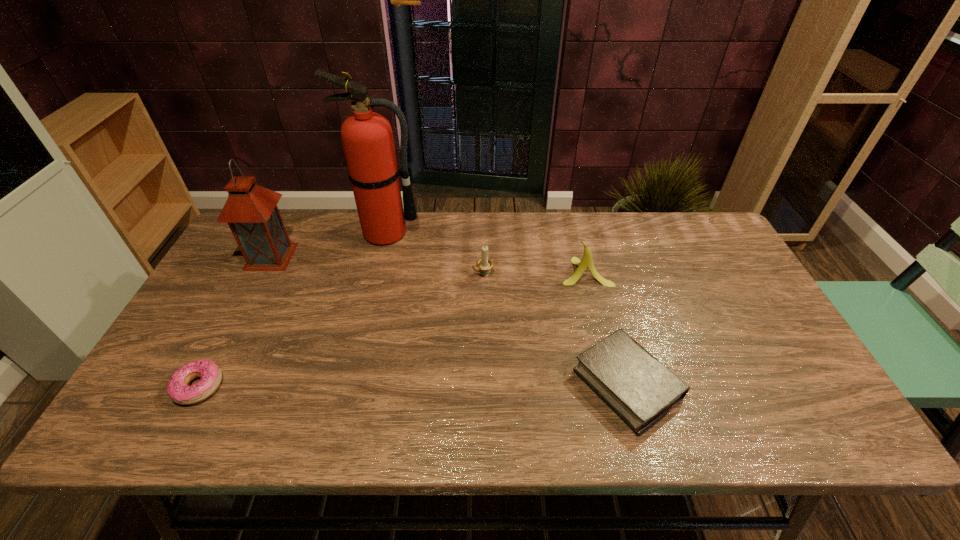
Where is `vacant region located 0.100m on the handle side of the third object from right to left`? The image size is (960, 540). vacant region located 0.100m on the handle side of the third object from right to left is located at coordinates (439, 275).

At what (x,y) coordinates should I click in order to perform the action: click on free spot located on the handle side of the third object from right to left. Please return your answer as a coordinate pair (x, y). The height and width of the screenshot is (540, 960). Looking at the image, I should click on (385, 275).

Locate an element on the screen. This screenshot has width=960, height=540. blank space located on the handle side of the third object from right to left is located at coordinates (378, 275).

Where is `vacant region located on the back of the second shortest object`? The height and width of the screenshot is (540, 960). vacant region located on the back of the second shortest object is located at coordinates (591, 256).

The height and width of the screenshot is (540, 960). I want to click on vacant space located on the back of the shortest object, so click(x=225, y=338).

Image resolution: width=960 pixels, height=540 pixels. Identify the location of fire extinguisher that is at the far edge. click(x=367, y=138).

This screenshot has height=540, width=960. What are the coordinates of `lantern that is positioned at the far edge` in the screenshot? It's located at (251, 211).

The width and height of the screenshot is (960, 540). Find the location of `banana that is at the far edge`. banana that is at the far edge is located at coordinates (587, 262).

Where is `Bible that is at the near edge`? Image resolution: width=960 pixels, height=540 pixels. Bible that is at the near edge is located at coordinates (641, 390).

This screenshot has height=540, width=960. Identify the location of doughnut present at the near edge. (177, 388).